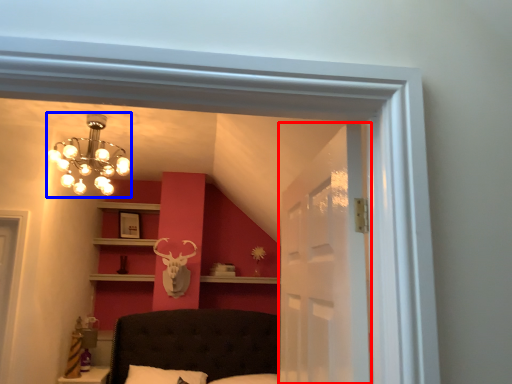
Question: Which object is closer to the camera taking this photo, glass door (highlighted by a red box) or lamp (highlighted by a blue box)?

Choices:
 (A) glass door
 (B) lamp

Answer: (A)